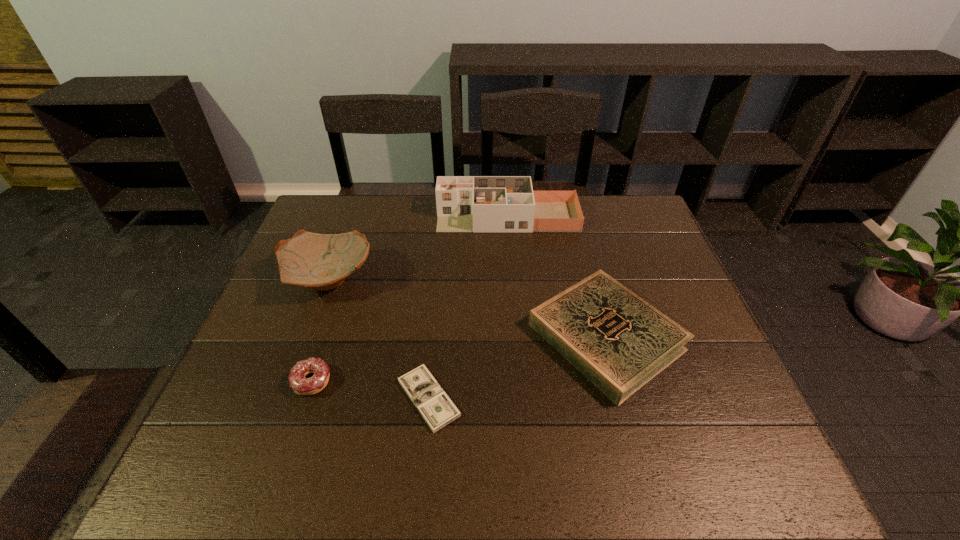
Identify the location of free region located 0.330m on the right of the doughnut. The image size is (960, 540). (478, 382).

The height and width of the screenshot is (540, 960). In order to click on vacant space situated on the left of the dollar in this screenshot , I will do `click(364, 398)`.

This screenshot has height=540, width=960. I want to click on object that is at the far edge, so click(x=464, y=203).

Identify the location of pottery situated at the left edge. The image size is (960, 540). (319, 261).

Locate an element on the screen. The height and width of the screenshot is (540, 960). doughnut present at the left edge is located at coordinates (301, 385).

Identify the location of object at the right edge. The height and width of the screenshot is (540, 960). (617, 340).

In the image, there is a desktop. Identify the location of vacant space at the near edge. (388, 483).

Locate an element on the screen. free spot at the left edge of the desktop is located at coordinates (254, 331).

Locate an element on the screen. This screenshot has width=960, height=540. free space at the right edge of the desktop is located at coordinates (685, 289).

Identify the location of blank space at the far left corner of the desktop. The width and height of the screenshot is (960, 540). (339, 204).